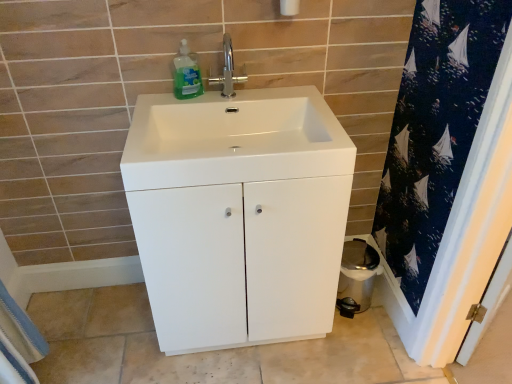
This screenshot has height=384, width=512. Describe the element at coordinates (234, 138) in the screenshot. I see `white glossy sink at center` at that location.

Image resolution: width=512 pixels, height=384 pixels. In order to click on white glossy cabinet at center in this screenshot , I will do `click(241, 259)`.

Describe the element at coordinates (187, 74) in the screenshot. Image resolution: width=512 pixels, height=384 pixels. I see `green translucent liquid at upper center` at that location.

Describe the element at coordinates (18, 342) in the screenshot. I see `white cotton bath towel at lower left` at that location.

You are a GUI agent. You are given a task and a screenshot of the screen. Output one action in this format:
    pyautogui.click(x=<x>, y=<y>)
    Task: Click on the white glossy sink at center
    
    Given the screenshot: What is the action you would take?
    pyautogui.click(x=234, y=138)

Is white glossy toilet bowl at lower right next to green translucent liquid at upper center and touching it?

No, white glossy toilet bowl at lower right is not beside green translucent liquid at upper center.

From the image's perspective, does white glossy toilet bowl at lower right appear lower than green translucent liquid at upper center?

Yes, from the image's perspective, white glossy toilet bowl at lower right is beneath green translucent liquid at upper center.

From the picture: Is white glossy toilet bowl at lower right to the right of green translucent liquid at upper center from the viewer's perspective?

Indeed, white glossy toilet bowl at lower right is positioned on the right side of green translucent liquid at upper center.

How distant is white glossy toilet bowl at lower right from green translucent liquid at upper center?

white glossy toilet bowl at lower right is 1.01 meters from green translucent liquid at upper center.

Is polished chrome faucet at center not within white glossy sink at center?

Indeed, polished chrome faucet at center is completely outside white glossy sink at center.

From a real-world perspective, is polished chrome faucet at center on white glossy sink at center?

Yes, from a real-world perspective, polished chrome faucet at center is over white glossy sink at center

In the scene shown: Which point is more forward, [223,93] or [158,106]?

The point [158,106] is in front.

Where is `bathroom cabinet on the right side of white cotton bath towel at lower left`? Image resolution: width=512 pixels, height=384 pixels. bathroom cabinet on the right side of white cotton bath towel at lower left is located at coordinates (241, 259).

From the image's perspective, between white glossy cabinet at center and white cotton bath towel at lower left, which one is located above?

white glossy cabinet at center, from the image's perspective.

Looking at this image, which of these two, green translucent liquid at upper center or polished chrome faucet at center, is wider?

green translucent liquid at upper center.

Between green translucent liquid at upper center and polished chrome faucet at center, which one is positioned behind?

Positioned behind is polished chrome faucet at center.

Does green translucent liquid at upper center turn towards polished chrome faucet at center?

No, green translucent liquid at upper center is not aimed at polished chrome faucet at center.

How much distance is there between green translucent liquid at upper center and polished chrome faucet at center?

The distance of green translucent liquid at upper center from polished chrome faucet at center is 8.89 centimeters.

Between point (28, 319) and point (236, 78), which one is positioned in front?

Positioned in front is point (236, 78).

Based on the photo, is white cotton bath towel at lower left not within polished chrome faucet at center?

Yes, white cotton bath towel at lower left is located beyond the bounds of polished chrome faucet at center.

From a real-world perspective, which is physically below, white cotton bath towel at lower left or polished chrome faucet at center?

In real-world perspective, white cotton bath towel at lower left is lower.

Considering the sizes of white cotton bath towel at lower left and polished chrome faucet at center in the image, is white cotton bath towel at lower left bigger or smaller than polished chrome faucet at center?

white cotton bath towel at lower left is smaller than polished chrome faucet at center.

Is green translucent liquid at upper center bigger or smaller than white glossy toilet bowl at lower right?

green translucent liquid at upper center is smaller than white glossy toilet bowl at lower right.

From the image's perspective, would you say green translucent liquid at upper center is positioned over white glossy toilet bowl at lower right?

Yes, from the image's perspective, green translucent liquid at upper center is over white glossy toilet bowl at lower right.

Between green translucent liquid at upper center and white glossy toilet bowl at lower right, which one has larger width?

white glossy toilet bowl at lower right is wider.

I want to click on cleaning product above the white glossy toilet bowl at lower right (from the image's perspective), so point(187,74).

Which is nearer, (208, 78) or (197, 87)?

The point (197, 87) is more forward.

From a real-world perspective, is polished chrome faucet at center physically above green translucent liquid at upper center?

Yes, from a real-world perspective, polished chrome faucet at center is over green translucent liquid at upper center

Can you confirm if polished chrome faucet at center is taller than green translucent liquid at upper center?

Yes.

Considering the relative sizes of polished chrome faucet at center and green translucent liquid at upper center in the image provided, is polished chrome faucet at center bigger than green translucent liquid at upper center?

No, polished chrome faucet at center is not bigger than green translucent liquid at upper center.

Find the location of `toilet bowl on the right side of green translucent liquid at upper center`. toilet bowl on the right side of green translucent liquid at upper center is located at coordinates (356, 277).

I want to click on tap above the white glossy sink at center (from a real-world perspective), so click(228, 70).

Considering their positions, is white cotton bath towel at lower left positioned closer to white glossy toilet bowl at lower right than green translucent liquid at upper center?

green translucent liquid at upper center is positioned closer to the anchor white glossy toilet bowl at lower right.

When comparing their distances from polished chrome faucet at center, does white glossy toilet bowl at lower right or white glossy cabinet at center seem further?

white glossy toilet bowl at lower right lies further to polished chrome faucet at center than the other object.

Looking at the image, which one is located closer to white glossy cabinet at center, white cotton bath towel at lower left or green translucent liquid at upper center?

green translucent liquid at upper center.

When comparing their distances from white glossy toilet bowl at lower right, does white glossy cabinet at center or green translucent liquid at upper center seem closer?

Among the two, white glossy cabinet at center is located nearer to white glossy toilet bowl at lower right.

Based on their spatial positions, is white glossy cabinet at center or white cotton bath towel at lower left further from white glossy toilet bowl at lower right?

white cotton bath towel at lower left.

Based on their spatial positions, is white glossy sink at center or white cotton bath towel at lower left further from green translucent liquid at upper center?

white cotton bath towel at lower left is positioned further to the anchor green translucent liquid at upper center.

Considering their positions, is white glossy sink at center positioned further to white cotton bath towel at lower left than white glossy toilet bowl at lower right?

The object further to white cotton bath towel at lower left is white glossy toilet bowl at lower right.

Based on their spatial positions, is white glossy cabinet at center or polished chrome faucet at center closer to white glossy toilet bowl at lower right?

Among the two, white glossy cabinet at center is located nearer to white glossy toilet bowl at lower right.

Identify the location of tap between white cotton bath towel at lower left and white glossy cabinet at center from left to right. The width and height of the screenshot is (512, 384). coord(228,70).

Locate an element on the screen. cleaning product situated between white cotton bath towel at lower left and white glossy cabinet at center from left to right is located at coordinates (187, 74).

Locate an element on the screen. The width and height of the screenshot is (512, 384). cleaning product located between white cotton bath towel at lower left and white glossy toilet bowl at lower right in the left-right direction is located at coordinates (187, 74).

Find the location of `sink between polished chrome faucet at center and white glossy cabinet at center vertically`. sink between polished chrome faucet at center and white glossy cabinet at center vertically is located at coordinates (234, 138).